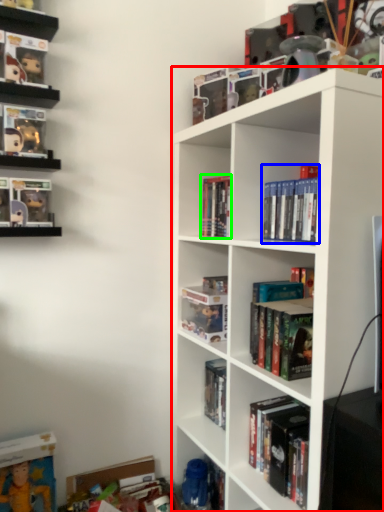
Question: Which is farther away from shelf (highlighted by a red box)? book (highlighted by a blue box) or book (highlighted by a green box)?

Choices:
 (A) book
 (B) book

Answer: (B)